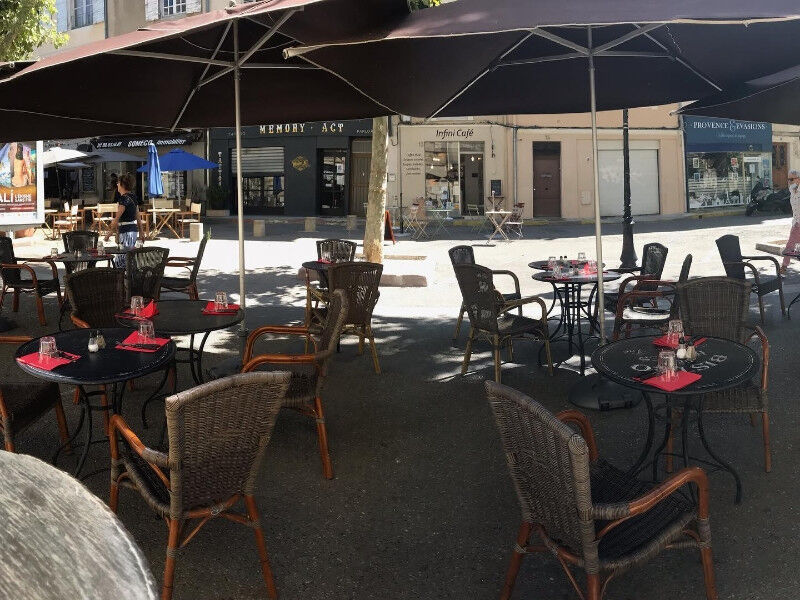
Find the location of a particular element. Image resolution: width=800 pixels, height=600 pixels. legs of chair is located at coordinates (177, 526), (250, 513).